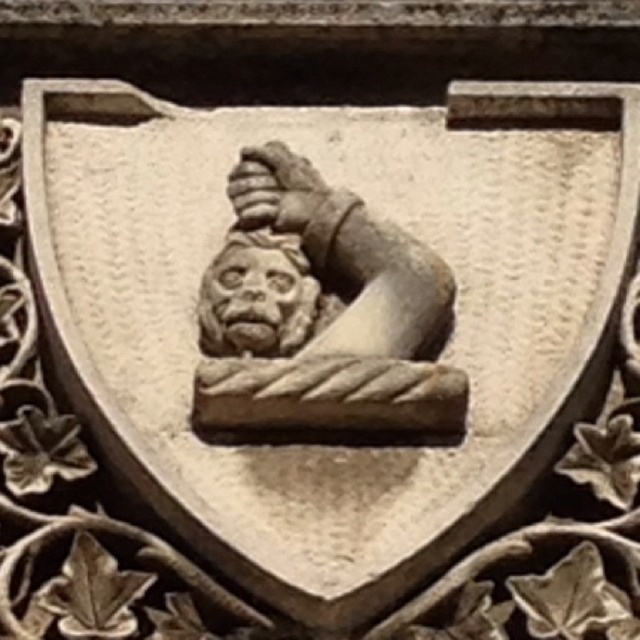
Which is more to the right, stone textured gargoyle at center or carved stone face at center?

From the viewer's perspective, stone textured gargoyle at center appears more on the right side.

Is stone textured gargoyle at center below carved stone face at center?

No, stone textured gargoyle at center is not below carved stone face at center.

I want to click on stone textured gargoyle at center, so click(321, 312).

Where is `stone textured gargoyle at center`? The width and height of the screenshot is (640, 640). stone textured gargoyle at center is located at coordinates (321, 312).